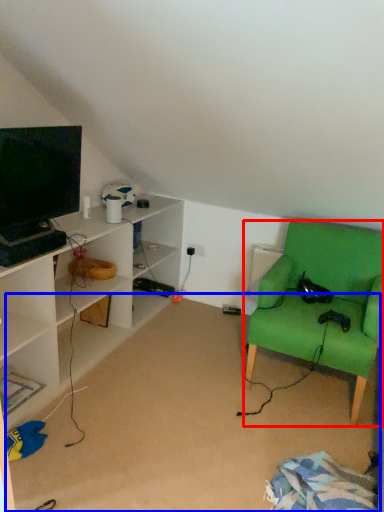
Question: Among these objects, which one is farthest to the camera, chair (highlighted by a red box) or plain (highlighted by a blue box)?

Choices:
 (A) chair
 (B) plain

Answer: (A)